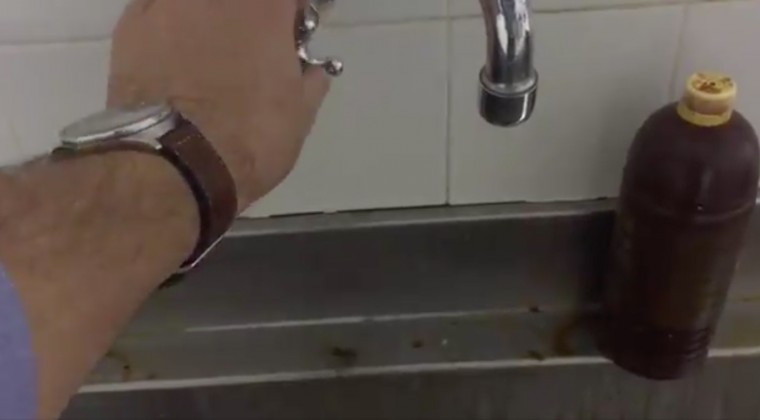
Identify the location of tiles. (407, 150), (529, 152), (43, 77).